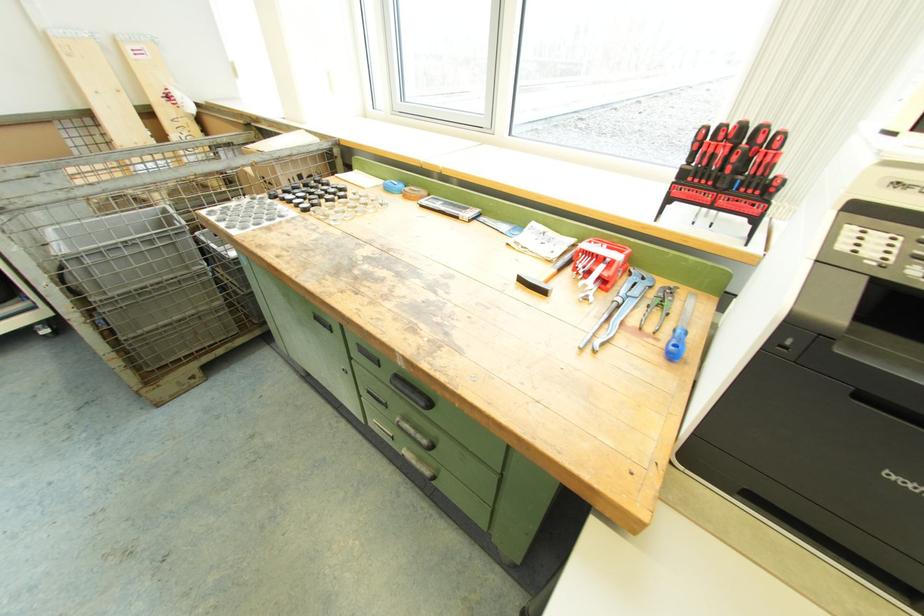
The image size is (924, 616). Find the location of `drawer handle`. drawer handle is located at coordinates (411, 392).